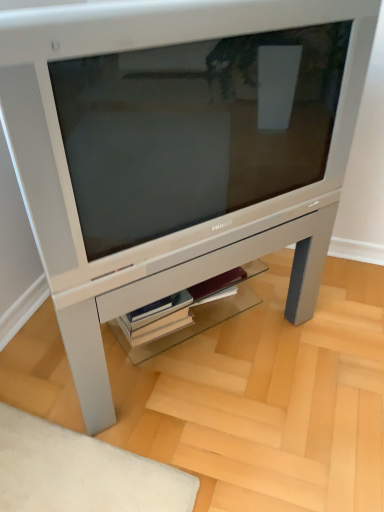
Question: Is satin silver monitor at center outside of white glossy shelf at center?

Choices:
 (A) yes
 (B) no

Answer: (A)

Question: Would you consider satin silver monitor at center to be distant from white glossy shelf at center?

Choices:
 (A) no
 (B) yes

Answer: (A)

Question: Does satin silver monitor at center have a greater height compared to white glossy shelf at center?

Choices:
 (A) yes
 (B) no

Answer: (A)

Question: Can you confirm if satin silver monitor at center is thinner than white glossy shelf at center?

Choices:
 (A) yes
 (B) no

Answer: (B)

Question: Is white glossy shelf at center completely or partially inside satin silver monitor at center?

Choices:
 (A) yes
 (B) no

Answer: (B)

Question: Does point (97, 431) appear closer or farther from the camera than point (221, 297)?

Choices:
 (A) closer
 (B) farther

Answer: (A)

Question: Based on their positions, is satin silver table at center located to the left or right of white glossy shelf at center?

Choices:
 (A) right
 (B) left

Answer: (A)

Question: From the image's perspective, relative to white glossy shelf at center, is satin silver table at center above or below?

Choices:
 (A) below
 (B) above

Answer: (B)

Question: In the image, is satin silver table at center positioned in front of or behind white glossy shelf at center?

Choices:
 (A) behind
 (B) front

Answer: (B)

Question: In terms of width, does satin silver monitor at center look wider or thinner when compared to satin silver table at center?

Choices:
 (A) thin
 (B) wide

Answer: (A)

Question: Based on their positions, is satin silver monitor at center located to the left or right of satin silver table at center?

Choices:
 (A) left
 (B) right

Answer: (A)

Question: Is satin silver monitor at center in front of or behind satin silver table at center in the image?

Choices:
 (A) front
 (B) behind

Answer: (A)

Question: From a real-world perspective, is satin silver monitor at center positioned above or below satin silver table at center?

Choices:
 (A) below
 (B) above

Answer: (B)

Question: In the image, is satin silver monitor at center on the left side or the right side of white glossy shelf at center?

Choices:
 (A) left
 (B) right

Answer: (B)

Question: Does point [x=71, y=146] appear closer or farther from the camera than point [x=190, y=315]?

Choices:
 (A) closer
 (B) farther

Answer: (A)